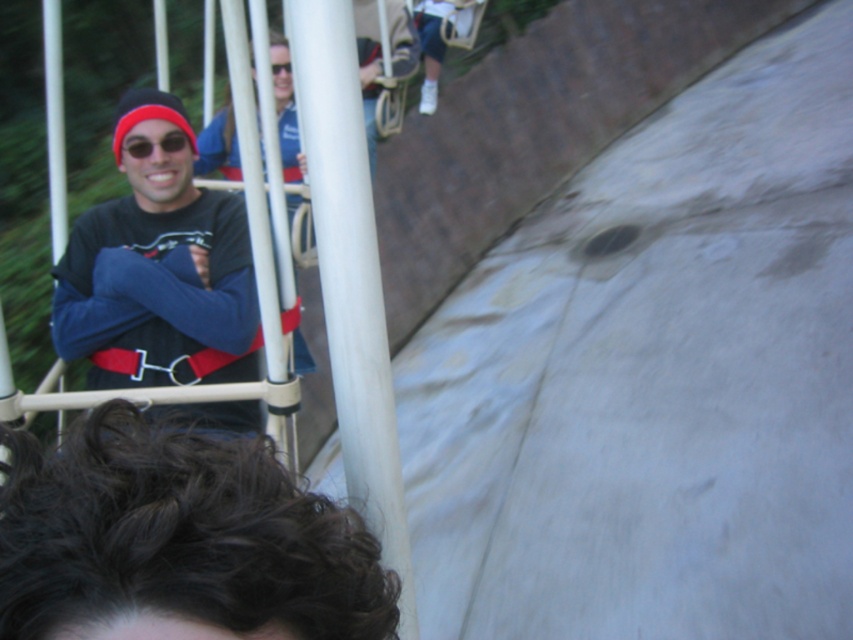
You are a safety inspector checking the roller coaster. You need to ensure that the dark brown hair at upper left is at least 36 inches away from the ride structure to prevent entanglement. Is the current distance compliant with safety regulations?

The dark brown hair at upper left is only 30.87 inches away from the viewer, which is less than the required 36 inches. Therefore, it does not comply with safety regulations and poses a risk of entanglement.

You are a photographer trying to capture a clear photo of the dark brown hair at upper left and the matte black shirt at left. Which object is positioned lower in the frame?

The dark brown hair at upper left is below the matte black shirt at left, so it is positioned lower in the frame.

Based on the scene, where is the dark brown hair at upper left located in terms of coordinates?

The dark brown hair at upper left is located at coordinates point (x=178, y=540).